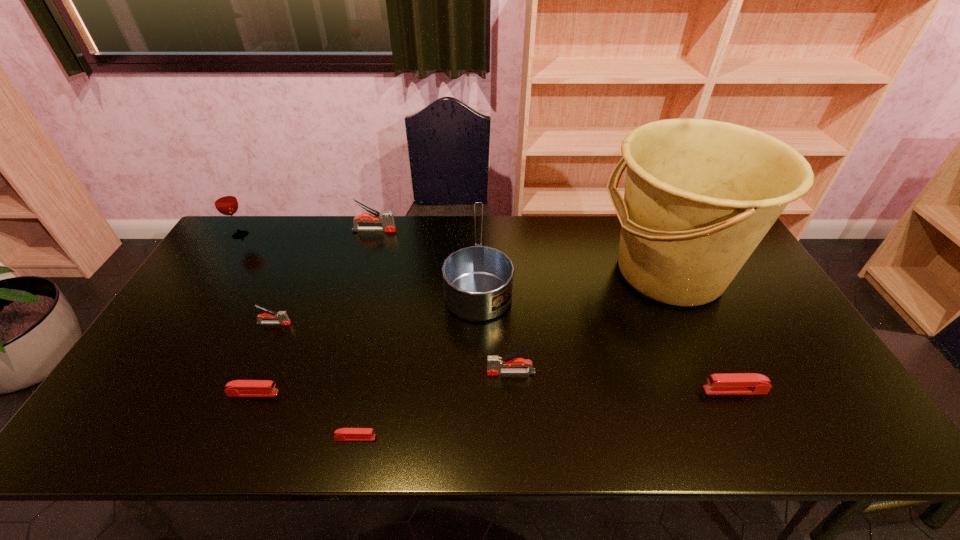
In order to click on bucket located at the far edge in this screenshot , I will do `click(700, 195)`.

Identify the location of glass present at the far edge. The width and height of the screenshot is (960, 540). (226, 203).

Locate an element on the screen. The height and width of the screenshot is (540, 960). stapler that is at the far edge is located at coordinates (386, 218).

At what (x,y) coordinates should I click in order to perform the action: click on saucepan that is at the far edge. Please return your answer as a coordinate pair (x, y). This screenshot has height=540, width=960. Looking at the image, I should click on (478, 280).

You are a GUI agent. You are given a task and a screenshot of the screen. Output one action in this format:
    pyautogui.click(x=<x>, y=<y>)
    Task: Click on the object located at the near edge
    The width and height of the screenshot is (960, 540).
    Given the screenshot: What is the action you would take?
    pyautogui.click(x=343, y=434)

The image size is (960, 540). Identify the location of object located at the left edge. point(226,203).

Locate an element on the screen. object that is at the right edge is located at coordinates (700, 195).

Locate an element on the screen. The image size is (960, 540). object that is at the far left corner is located at coordinates (226, 203).

Where is `object that is at the far right corner`? This screenshot has width=960, height=540. object that is at the far right corner is located at coordinates (700, 195).

Locate an element on the screen. The height and width of the screenshot is (540, 960). vacant space at the far edge of the desktop is located at coordinates (571, 257).